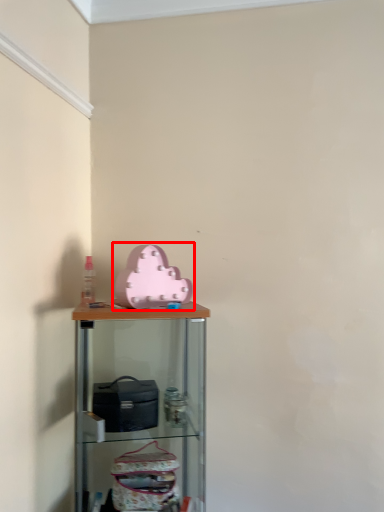
Question: From the image's perspective, where is toy (annotated by the red box) located in relation to shelf in the image?

Choices:
 (A) below
 (B) above

Answer: (B)